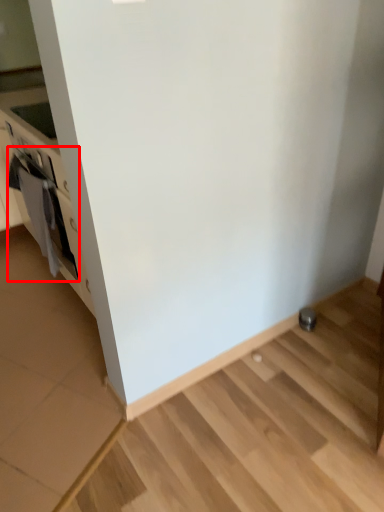
Question: From the image's perspective, where is oven (annotated by the red box) located relative to appliance?

Choices:
 (A) below
 (B) above

Answer: (B)